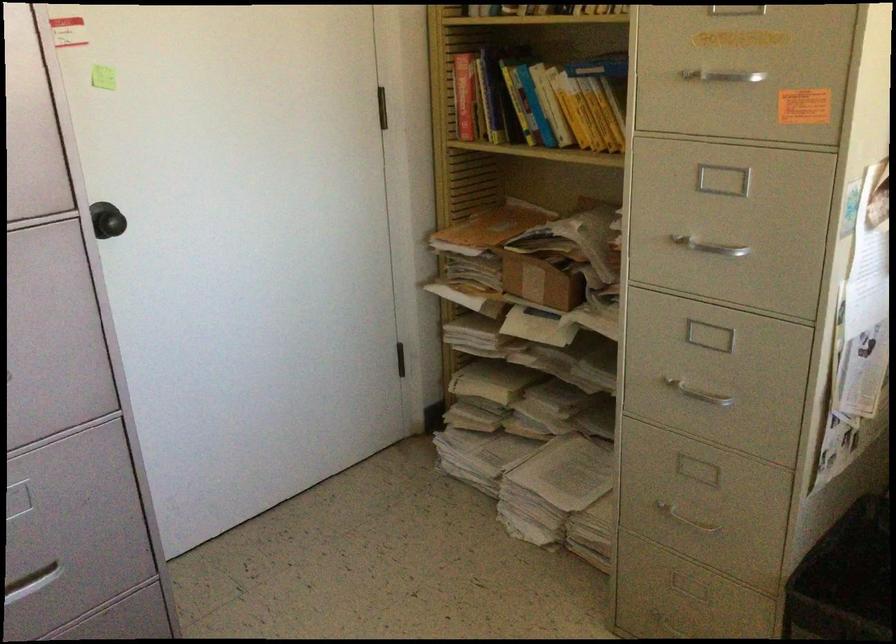
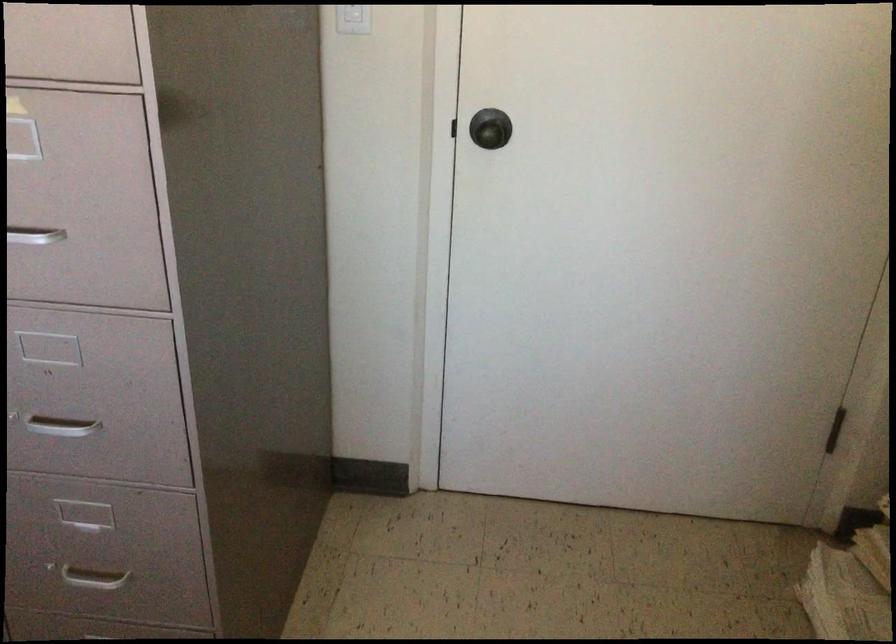
Question: Based on the continuous images, in which direction is the camera rotating? Reply with the corresponding letter.

Choices:
 (A) Left
 (B) Right
 (C) Up
 (D) Down

Answer: (A)